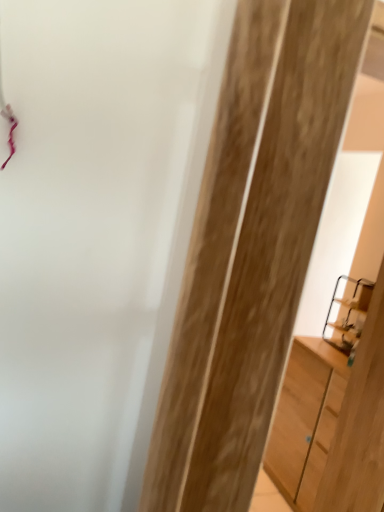
The width and height of the screenshot is (384, 512). What do you see at coordinates (251, 248) in the screenshot? I see `wooden plank at center` at bounding box center [251, 248].

Where is `wooden plank at center`? This screenshot has height=512, width=384. wooden plank at center is located at coordinates (251, 248).

Measure the distance between wooden plank at center and camera.

wooden plank at center is 5.52 inches from camera.

This screenshot has width=384, height=512. I want to click on wooden plank at center, so click(251, 248).